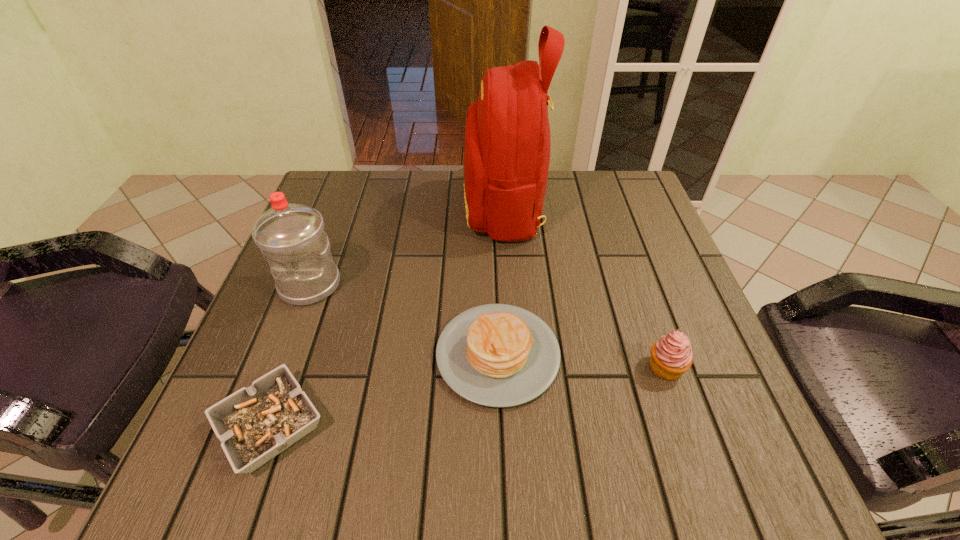
Where is `vacant space at the far edge of the desktop`? This screenshot has height=540, width=960. vacant space at the far edge of the desktop is located at coordinates (455, 183).

You are a GUI agent. You are given a task and a screenshot of the screen. Output one action in this format:
    pyautogui.click(x=<x>, y=<y>)
    Task: Click on the vacant region at the near edge
    The width and height of the screenshot is (960, 540).
    Given the screenshot: What is the action you would take?
    [x=460, y=441]

This screenshot has height=540, width=960. I want to click on vacant region at the left edge, so click(348, 284).

Where is `vacant space at the right edge`? The width and height of the screenshot is (960, 540). vacant space at the right edge is located at coordinates (663, 295).

Identify the location of blank space at the far left corner of the desktop. (354, 174).

Image resolution: width=960 pixels, height=540 pixels. Identify the location of vacant area at the near left corner of the desktop. (191, 457).

The height and width of the screenshot is (540, 960). I want to click on free location at the far right corner, so click(x=645, y=196).

This screenshot has height=540, width=960. I want to click on vacant area at the near right corner, so click(743, 461).

Where is `free spot between the farthest object and the fourth shortest object`? free spot between the farthest object and the fourth shortest object is located at coordinates (407, 246).

The width and height of the screenshot is (960, 540). What are the coordinates of `vacant space that's between the water bottle and the pancake` in the screenshot? It's located at (404, 320).